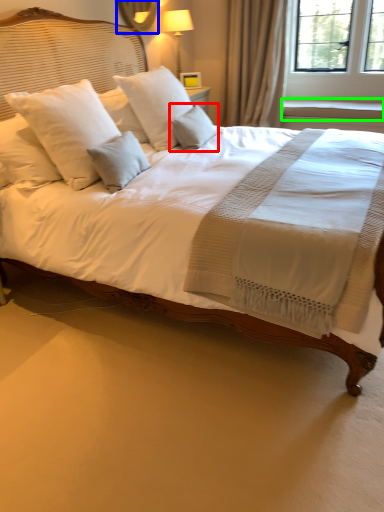
Question: Which object is the farthest from pillow (highlighted by a red box)? Choose among these: mirror (highlighted by a blue box) or window sill (highlighted by a green box).

Choices:
 (A) mirror
 (B) window sill

Answer: (B)